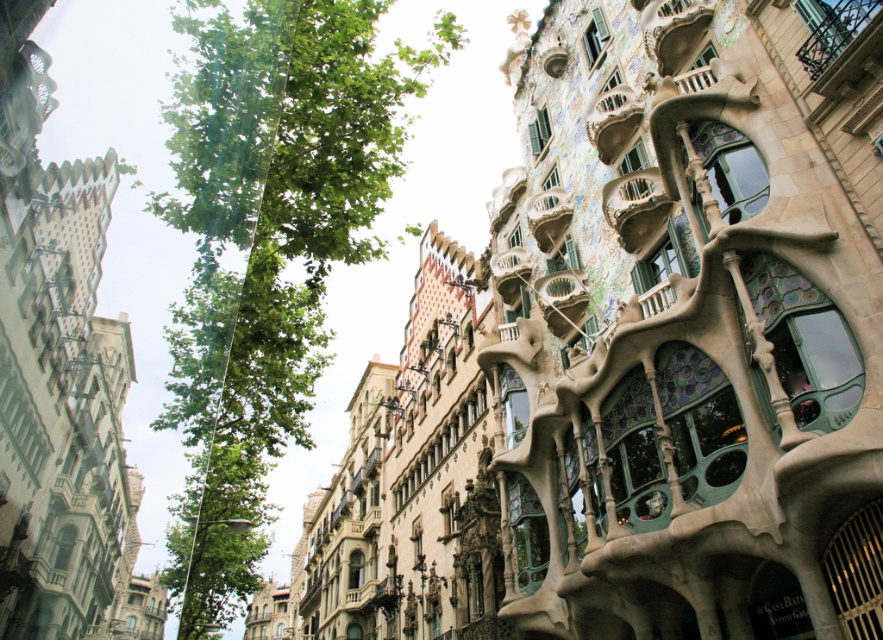
Between point (585, 125) and point (559, 196), which one is positioned in front?

Point (585, 125) is more forward.

Who is positioned more to the left, carved stone balcony at upper right or multicolored mosaic balcony at upper center?

From the viewer's perspective, multicolored mosaic balcony at upper center appears more on the left side.

The width and height of the screenshot is (883, 640). What are the coordinates of `carved stone balcony at upper right` in the screenshot? It's located at (612, 118).

This screenshot has width=883, height=640. I want to click on carved stone balcony at upper right, so (612, 118).

Looking at this image, can you confirm if stained glass balcony at upper right is wider than multicolored mosaic balcony at upper center?

Correct, the width of stained glass balcony at upper right exceeds that of multicolored mosaic balcony at upper center.

Is stained glass balcony at upper right to the right of multicolored mosaic balcony at upper center from the viewer's perspective?

Correct, you'll find stained glass balcony at upper right to the right of multicolored mosaic balcony at upper center.

This screenshot has height=640, width=883. In order to click on stained glass balcony at upper right in this screenshot , I will do `click(635, 205)`.

Who is positioned more to the right, green leafy tree at center or stained glass balcony at upper right?

stained glass balcony at upper right is more to the right.

Based on the photo, does green leafy tree at center appear on the left side of stained glass balcony at upper right?

Yes, green leafy tree at center is to the left of stained glass balcony at upper right.

At what (x,y) coordinates should I click in order to perform the action: click on green leafy tree at center. Please return your answer as a coordinate pair (x, y). The height and width of the screenshot is (640, 883). Looking at the image, I should click on (268, 246).